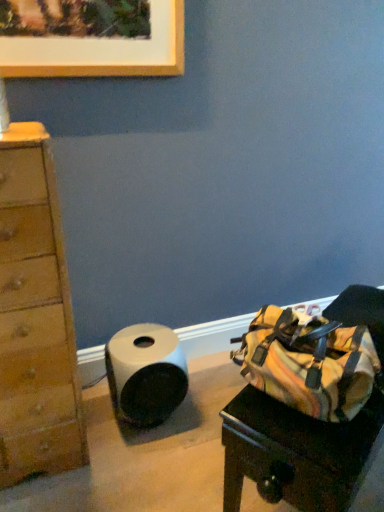
Question: Is white matte paper towel at lower left smaller than striped canvas duffel bag at right?

Choices:
 (A) yes
 (B) no

Answer: (A)

Question: Is white matte paper towel at lower left with striped canvas duffel bag at right?

Choices:
 (A) yes
 (B) no

Answer: (B)

Question: From the image's perspective, would you say white matte paper towel at lower left is positioned over striped canvas duffel bag at right?

Choices:
 (A) no
 (B) yes

Answer: (B)

Question: Considering the relative sizes of white matte paper towel at lower left and striped canvas duffel bag at right in the image provided, is white matte paper towel at lower left thinner than striped canvas duffel bag at right?

Choices:
 (A) no
 (B) yes

Answer: (B)

Question: From the image's perspective, is white matte paper towel at lower left located beneath striped canvas duffel bag at right?

Choices:
 (A) yes
 (B) no

Answer: (B)

Question: From a real-world perspective, is white matte paper towel at lower left beneath striped canvas duffel bag at right?

Choices:
 (A) no
 (B) yes

Answer: (B)

Question: Is striped canvas duffel bag at right far from white matte paper towel at lower left?

Choices:
 (A) no
 (B) yes

Answer: (A)

Question: Considering the relative sizes of striped canvas duffel bag at right and white matte paper towel at lower left in the image provided, is striped canvas duffel bag at right wider than white matte paper towel at lower left?

Choices:
 (A) yes
 (B) no

Answer: (A)

Question: Does striped canvas duffel bag at right lie in front of white matte paper towel at lower left?

Choices:
 (A) no
 (B) yes

Answer: (B)

Question: Does striped canvas duffel bag at right have a smaller size compared to white matte paper towel at lower left?

Choices:
 (A) no
 (B) yes

Answer: (A)

Question: Is striped canvas duffel bag at right to the right of white matte paper towel at lower left from the viewer's perspective?

Choices:
 (A) yes
 (B) no

Answer: (A)

Question: Does striped canvas duffel bag at right have a larger size compared to white matte paper towel at lower left?

Choices:
 (A) no
 (B) yes

Answer: (B)

Question: In terms of size, does white matte paper towel at lower left appear bigger or smaller than striped canvas duffel bag at right?

Choices:
 (A) small
 (B) big

Answer: (A)